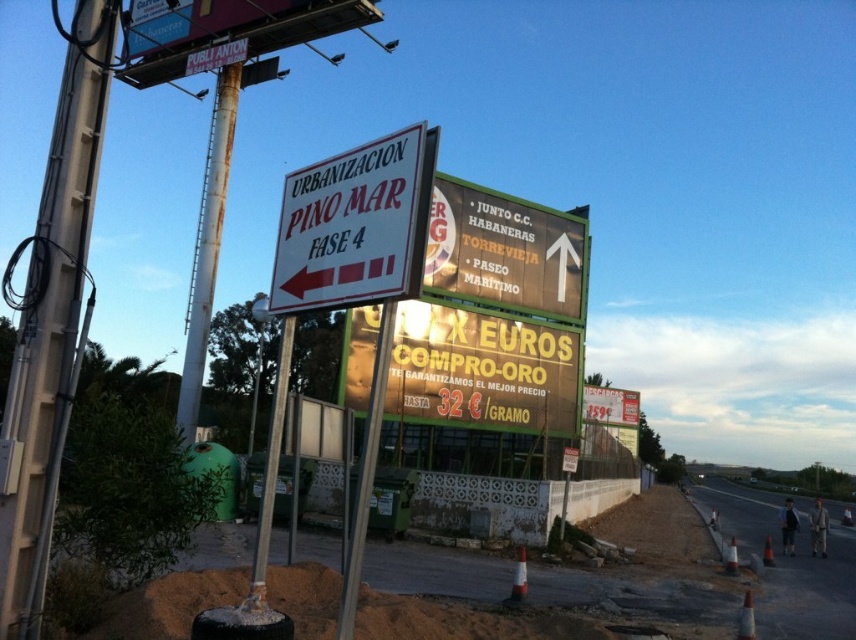
Question: Which of these objects is positioned farthest from the rusty metal pole at left?

Choices:
 (A) metallic pole at center
 (B) white matte sign at left

Answer: (B)

Question: Is green matte sign at upper center bigger than metallic pole at center?

Choices:
 (A) no
 (B) yes

Answer: (B)

Question: Can you confirm if rusty metal pole at left is smaller than metallic pole at center?

Choices:
 (A) yes
 (B) no

Answer: (B)

Question: Which point is farther to the camera?

Choices:
 (A) metallic pole at center
 (B) green matte sign at upper center
 (C) rusty metal pole at left

Answer: (C)

Question: Can you confirm if green matte sign at upper center is thinner than metallic pole at center?

Choices:
 (A) no
 (B) yes

Answer: (A)

Question: Which object appears closest to the camera in this image?

Choices:
 (A) metallic pole at center
 (B) white matte sign at left

Answer: (B)